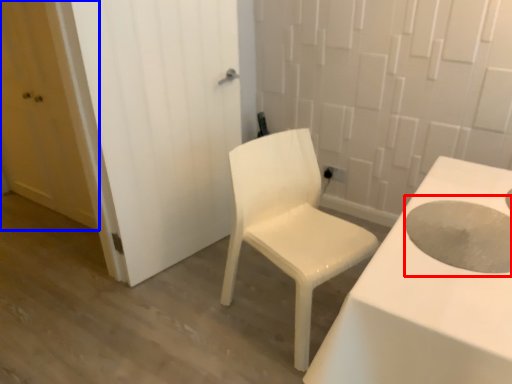
Question: Among these objects, which one is nearest to the camera, hole (highlighted by a red box) or door (highlighted by a blue box)?

Choices:
 (A) hole
 (B) door

Answer: (A)